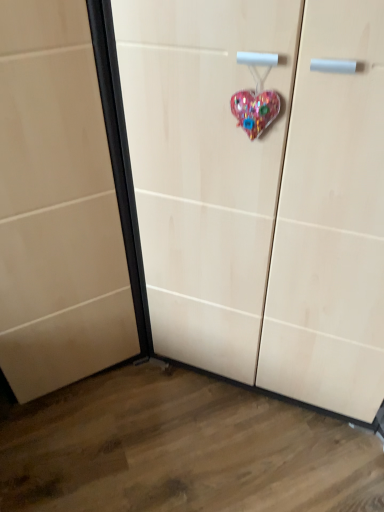
This screenshot has width=384, height=512. What do you see at coordinates (57, 206) in the screenshot? I see `matte white door at lower left` at bounding box center [57, 206].

This screenshot has height=512, width=384. Identify the location of matte white door at lower left. (57, 206).

Find the location of a particular element. The image size is (384, 512). matte white door at lower left is located at coordinates (57, 206).